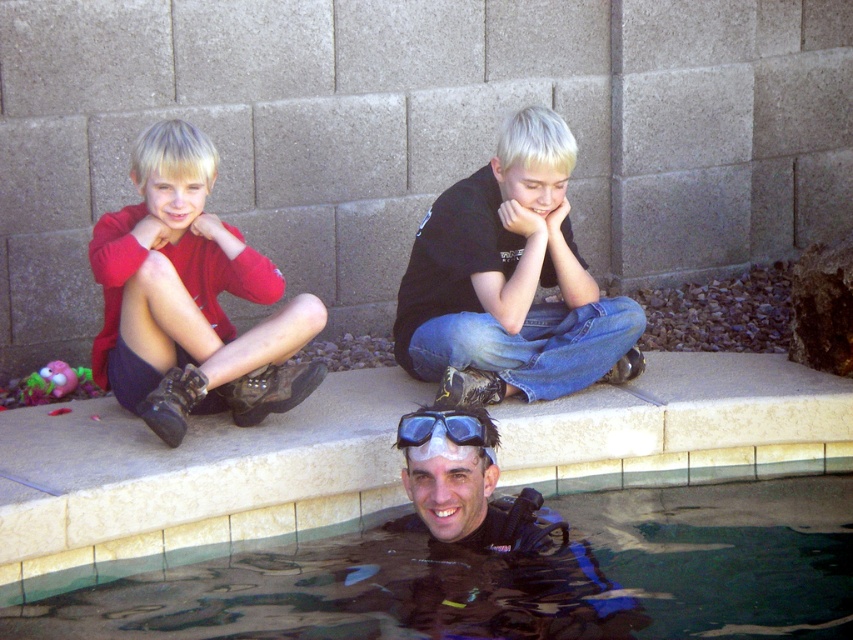
Between clear glass water at lower center and matte red hoodie at left, which one has more height?

With more height is matte red hoodie at left.

Is point (737, 492) more distant than point (169, 340)?

Yes, point (737, 492) is behind point (169, 340).

Identify the location of clear glass water at lower center. (514, 577).

I want to click on clear glass water at lower center, so click(514, 577).

Who is positioned more to the left, black matte shirt at center or matte red hoodie at left?

Positioned to the left is matte red hoodie at left.

Which is more to the right, black matte shirt at center or matte red hoodie at left?

From the viewer's perspective, black matte shirt at center appears more on the right side.

Identify the location of black matte shirt at center. The height and width of the screenshot is (640, 853). point(508,280).

Is the position of black matte shirt at center more distant than that of blue matte goggles at lower center?

That is True.

Measure the distance between point (480,349) and camera.

Point (480,349) is 5.57 meters from camera.

Which is behind, point (502, 154) or point (465, 417)?

The point (502, 154) is behind.

Find the location of a particular element. This screenshot has height=640, width=853. black matte shirt at center is located at coordinates (508, 280).